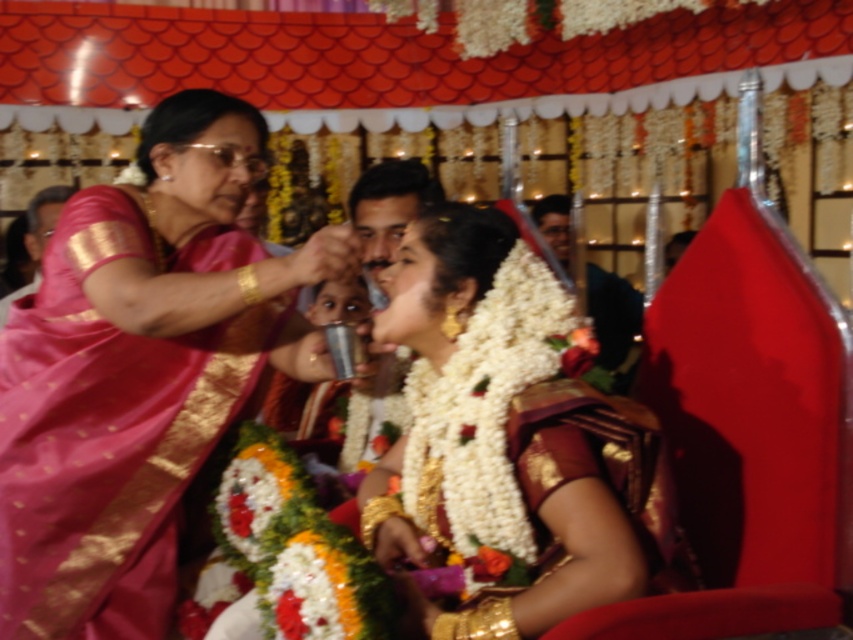
Is white floral garland at center positioned behind dark green fabric at upper center?

No, it is not.

Which of these two, white floral garland at center or dark green fabric at upper center, stands shorter?

dark green fabric at upper center is shorter.

Measure the distance between point [567,410] and camera.

Point [567,410] and camera are 4.53 feet apart.

The height and width of the screenshot is (640, 853). Identify the location of white floral garland at center. (508, 438).

Does pink silk saree at upper left appear on the right side of dark green fabric at upper center?

In fact, pink silk saree at upper left is to the left of dark green fabric at upper center.

Is point (180, 193) farther from camera compared to point (546, 212)?

No, (180, 193) is in front of (546, 212).

You are a GUI agent. You are given a task and a screenshot of the screen. Output one action in this format:
    pyautogui.click(x=<x>, y=<y>)
    Task: Click on the pink silk saree at upper left
    Image resolution: width=853 pixels, height=640 pixels.
    Given the screenshot: What is the action you would take?
    pyautogui.click(x=140, y=369)

In the scene shown: Does pink silk saree at upper left have a greater width compared to white floral garland at center?

Indeed, pink silk saree at upper left has a greater width compared to white floral garland at center.

Who is more distant from viewer, (x=234, y=138) or (x=451, y=324)?

Point (x=234, y=138)

Describe the element at coordinates (140, 369) in the screenshot. Image resolution: width=853 pixels, height=640 pixels. I see `pink silk saree at upper left` at that location.

Locate an element on the screen. pink silk saree at upper left is located at coordinates (140, 369).